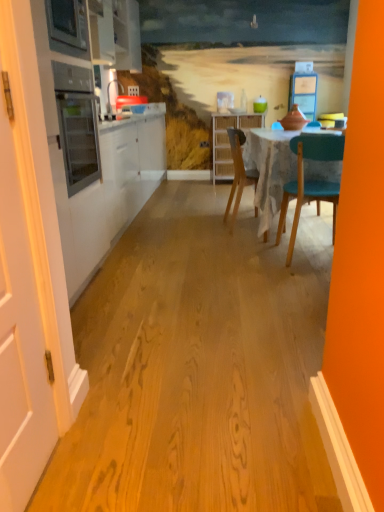
Question: From a real-world perspective, is wooden chair at center below white glossy cabinet at upper left, which is counted as the 1th cabinetry, starting from the top?

Choices:
 (A) yes
 (B) no

Answer: (A)

Question: Does wooden chair at center appear on the right side of white glossy cabinet at upper left, which is counted as the 1th cabinetry, starting from the top?

Choices:
 (A) no
 (B) yes

Answer: (B)

Question: Are wooden chair at center and white glossy cabinet at upper left, which is the second cabinetry from back to front, far apart?

Choices:
 (A) yes
 (B) no

Answer: (A)

Question: Is wooden chair at center to the left of white glossy cabinet at upper left, the 1th cabinetry when ordered from front to back, from the viewer's perspective?

Choices:
 (A) yes
 (B) no

Answer: (B)

Question: Is wooden chair at center aimed at white glossy cabinet at upper left, which is the 2th cabinetry from right to left?

Choices:
 (A) yes
 (B) no

Answer: (B)

Question: Does wooden chair at center have a greater width compared to white glossy cabinet at upper left, which is the second cabinetry from back to front?

Choices:
 (A) yes
 (B) no

Answer: (A)

Question: Could you tell me if white matte door at left is turned towards wooden chair at center?

Choices:
 (A) no
 (B) yes

Answer: (A)

Question: Is white matte door at left not near wooden chair at center?

Choices:
 (A) no
 (B) yes

Answer: (B)

Question: Does white matte door at left appear on the left side of wooden chair at center?

Choices:
 (A) no
 (B) yes

Answer: (B)

Question: From a real-world perspective, is white matte door at left under wooden chair at center?

Choices:
 (A) no
 (B) yes

Answer: (A)

Question: Is white matte door at left smaller than wooden chair at center?

Choices:
 (A) yes
 (B) no

Answer: (A)

Question: Does white matte door at left contain wooden chair at center?

Choices:
 (A) yes
 (B) no

Answer: (B)

Question: From a real-world perspective, is woven wood cabinet at center, the first cabinetry positioned from the back, located higher than wooden chair at center?

Choices:
 (A) no
 (B) yes

Answer: (B)